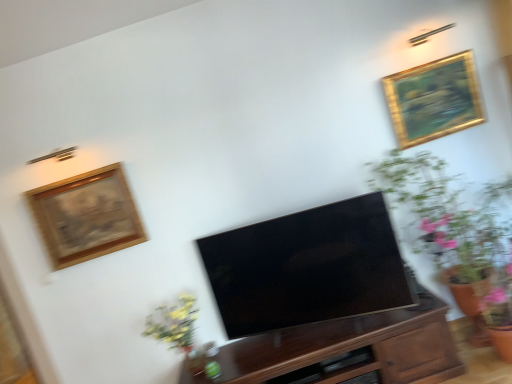
The width and height of the screenshot is (512, 384). What are the coordinates of `free space underneath matte black tv at center (from a real-world perspective)` in the screenshot? It's located at (328, 329).